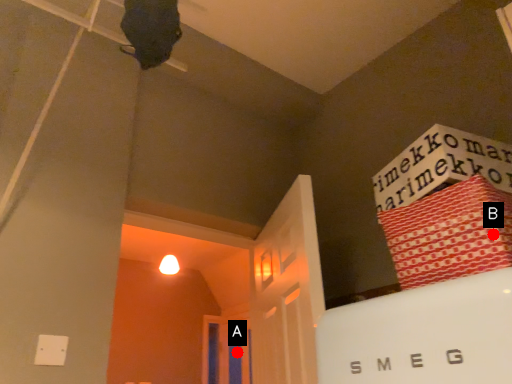
Question: Two points are circled on the image, labeled by A and B beside each circle. Which point appears farthest from the camera in this image?

Choices:
 (A) A is further
 (B) B is further

Answer: (A)